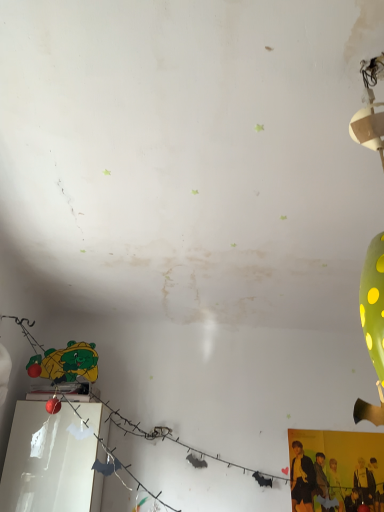
Image resolution: width=384 pixels, height=512 pixels. What are the coordinates of `yellow fabric poster at lower right` in the screenshot? It's located at (335, 470).

Describe the element at coordinates (335, 470) in the screenshot. I see `yellow fabric poster at lower right` at that location.

At what (x,y) coordinates should I click in order to perform the action: click on yellow fabric poster at lower right. Please return your answer as a coordinate pair (x, y). Looking at the image, I should click on (335, 470).